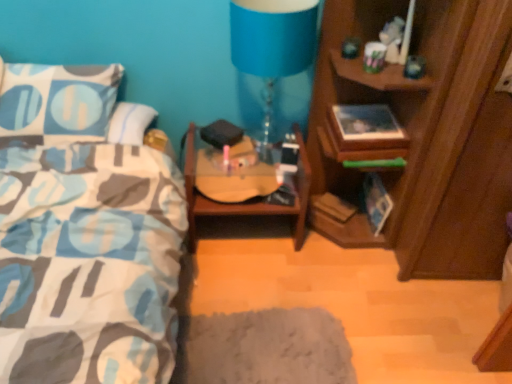
Question: From the image's perspective, would you say wooden cabinet at right is shown under wooden guitar case at center?

Choices:
 (A) no
 (B) yes

Answer: (A)

Question: Would you say wooden cabinet at right is a long distance from wooden guitar case at center?

Choices:
 (A) no
 (B) yes

Answer: (A)

Question: Is wooden cabinet at right further to camera compared to wooden guitar case at center?

Choices:
 (A) yes
 (B) no

Answer: (B)

Question: Considering the relative sizes of wooden cabinet at right and wooden guitar case at center in the image provided, is wooden cabinet at right smaller than wooden guitar case at center?

Choices:
 (A) yes
 (B) no

Answer: (B)

Question: Is wooden cabinet at right closer to the viewer compared to wooden guitar case at center?

Choices:
 (A) no
 (B) yes

Answer: (B)

Question: Considering the positions of wooden cabinet at right and blue fabric lampshade at upper center in the image, is wooden cabinet at right bigger or smaller than blue fabric lampshade at upper center?

Choices:
 (A) small
 (B) big

Answer: (B)

Question: Is point (510, 132) positioned closer to the camera than point (267, 97)?

Choices:
 (A) closer
 (B) farther

Answer: (A)

Question: In the image, is wooden cabinet at right positioned in front of or behind blue fabric lampshade at upper center?

Choices:
 (A) behind
 (B) front

Answer: (B)

Question: Considering the relative positions of wooden cabinet at right and blue fabric lampshade at upper center in the image provided, is wooden cabinet at right to the left or to the right of blue fabric lampshade at upper center?

Choices:
 (A) right
 (B) left

Answer: (A)

Question: Considering the relative positions of wooden guitar case at center and blue fabric lampshade at upper center in the image provided, is wooden guitar case at center to the left or to the right of blue fabric lampshade at upper center?

Choices:
 (A) right
 (B) left

Answer: (B)

Question: From their relative heights in the image, would you say wooden guitar case at center is taller or shorter than blue fabric lampshade at upper center?

Choices:
 (A) tall
 (B) short

Answer: (B)

Question: From a real-world perspective, is wooden guitar case at center physically located above or below blue fabric lampshade at upper center?

Choices:
 (A) above
 (B) below

Answer: (B)

Question: Does point (225, 210) appear closer or farther from the camera than point (263, 122)?

Choices:
 (A) closer
 (B) farther

Answer: (A)

Question: Considering the positions of wooden guitar case at center and wooden cabinet at right in the image, is wooden guitar case at center taller or shorter than wooden cabinet at right?

Choices:
 (A) short
 (B) tall

Answer: (A)

Question: In terms of size, does wooden guitar case at center appear bigger or smaller than wooden cabinet at right?

Choices:
 (A) small
 (B) big

Answer: (A)